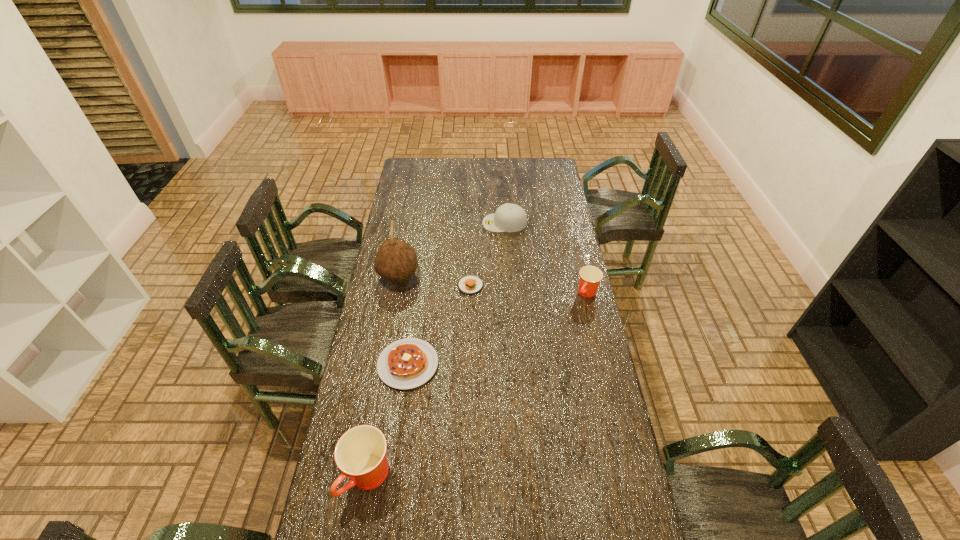
In order to click on coconut located at the left edge in this screenshot , I will do `click(395, 260)`.

At what (x,y) coordinates should I click in order to perform the action: click on object at the right edge. Please return your answer as a coordinate pair (x, y). Looking at the image, I should click on (590, 276).

The width and height of the screenshot is (960, 540). Identify the location of object that is at the near left corner. (360, 453).

You are a GUI agent. You are given a task and a screenshot of the screen. Output one action in this format:
    pyautogui.click(x=<x>, y=<y>)
    Task: Click on the vacant space at the far edge
    Image resolution: width=960 pixels, height=540 pixels.
    Given the screenshot: What is the action you would take?
    pyautogui.click(x=459, y=163)

In the image, there is a desktop. At what (x,y) coordinates should I click in order to perform the action: click on vacant space at the near edge. Please return your answer as a coordinate pair (x, y). Looking at the image, I should click on (465, 514).

At what (x,y) coordinates should I click in order to perform the action: click on free space at the left edge of the desktop. Please return your answer as a coordinate pair (x, y). Image resolution: width=960 pixels, height=540 pixels. Looking at the image, I should click on (396, 337).

I want to click on vacant space at the right edge of the desktop, so click(574, 313).

You are a GUI agent. You are given a task and a screenshot of the screen. Output one action in this format:
    pyautogui.click(x=<x>, y=<y>)
    Task: Click on the vacant point at the near left corner
    
    Given the screenshot: What is the action you would take?
    pyautogui.click(x=362, y=510)

I want to click on free space at the far right corner of the desktop, so click(x=560, y=178).

You are a GUI agent. You are given a task and a screenshot of the screen. Output one action in this format:
    pyautogui.click(x=<x>, y=<y>)
    Task: Click on the unoccupied position between the rightmost object and the fifth shortest object
    The height and width of the screenshot is (540, 960).
    Given the screenshot: What is the action you would take?
    pyautogui.click(x=478, y=385)